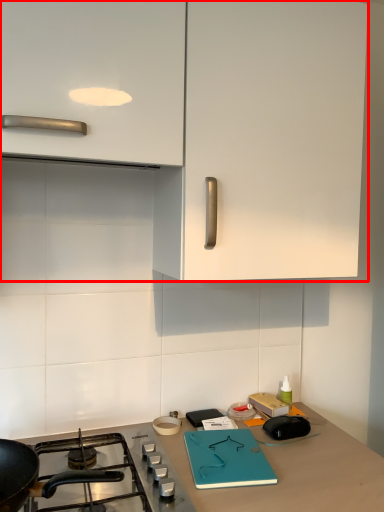
Question: From the image's perspective, what is the correct spatial positioning of cabinetry (annotated by the red box) in reference to gas stove?

Choices:
 (A) below
 (B) above

Answer: (B)